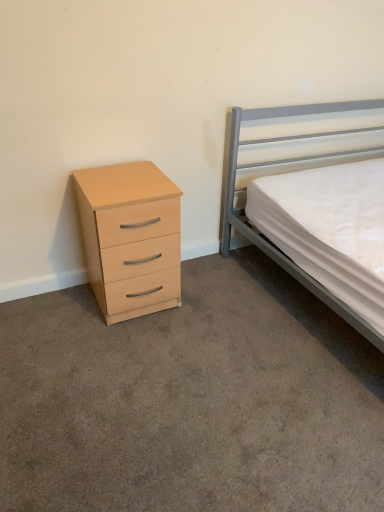
Question: In the image, is matte wood chest of drawers at left on the left side or the right side of metallic gray bed at right?

Choices:
 (A) left
 (B) right

Answer: (A)

Question: Is matte wood chest of drawers at left bigger or smaller than metallic gray bed at right?

Choices:
 (A) big
 (B) small

Answer: (B)

Question: Would you say matte wood chest of drawers at left is inside or outside metallic gray bed at right?

Choices:
 (A) inside
 (B) outside

Answer: (B)

Question: Considering the positions of metallic gray bed at right and matte wood chest of drawers at left in the image, is metallic gray bed at right wider or thinner than matte wood chest of drawers at left?

Choices:
 (A) thin
 (B) wide

Answer: (B)

Question: From a real-world perspective, is metallic gray bed at right above or below matte wood chest of drawers at left?

Choices:
 (A) above
 (B) below

Answer: (A)

Question: From their relative heights in the image, would you say metallic gray bed at right is taller or shorter than matte wood chest of drawers at left?

Choices:
 (A) tall
 (B) short

Answer: (A)

Question: Is point (231, 207) closer or farther from the camera than point (173, 304)?

Choices:
 (A) closer
 (B) farther

Answer: (B)